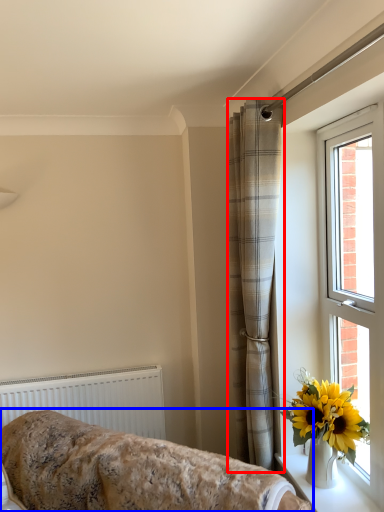
Question: Which point is further to the camera, curtain (highlighted by a red box) or furniture (highlighted by a blue box)?

Choices:
 (A) curtain
 (B) furniture

Answer: (A)